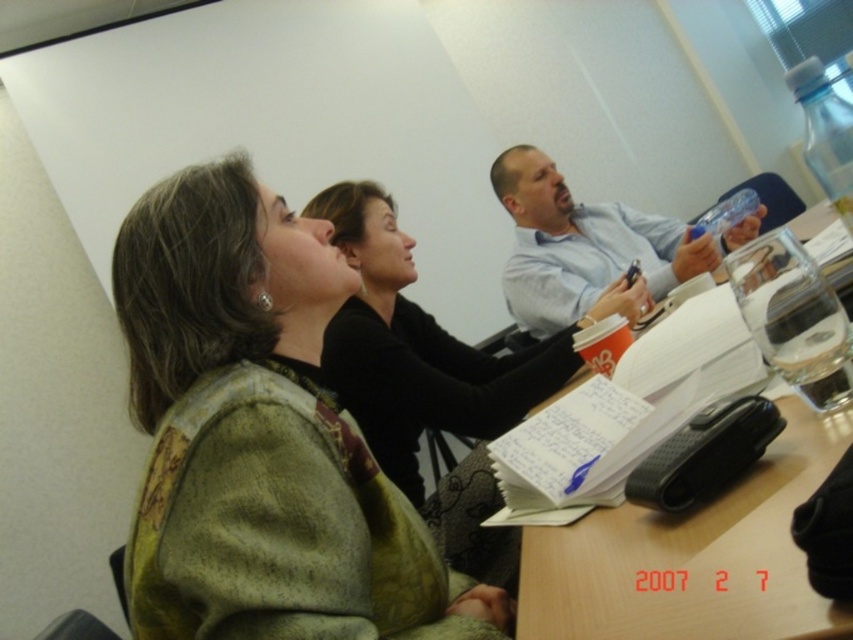
Consider the image. Is wooden table at center smaller than blue shirt at upper center?

Correct, wooden table at center occupies less space than blue shirt at upper center.

Who is shorter, wooden table at center or blue shirt at upper center?

Standing shorter between the two is wooden table at center.

Where is `wooden table at center`? The height and width of the screenshot is (640, 853). wooden table at center is located at coordinates (692, 557).

Does green textured sweater at center have a greater height compared to blue shirt at upper center?

Indeed, green textured sweater at center has a greater height compared to blue shirt at upper center.

Is green textured sweater at center thinner than blue shirt at upper center?

Answer: Correct, green textured sweater at center's width is less than blue shirt at upper center's.

This screenshot has width=853, height=640. Identify the location of green textured sweater at center. (260, 436).

At what (x,y) coordinates should I click in order to perform the action: click on green textured sweater at center. Please return your answer as a coordinate pair (x, y). Looking at the image, I should click on (260, 436).

Can you confirm if green textured sweater at center is positioned to the right of wooden table at center?

No, green textured sweater at center is not to the right of wooden table at center.

Which is below, green textured sweater at center or wooden table at center?

wooden table at center is below.

Is point (152, 547) in front of point (842, 628)?

No, it is behind (842, 628).

Locate an element on the screen. green textured sweater at center is located at coordinates [260, 436].